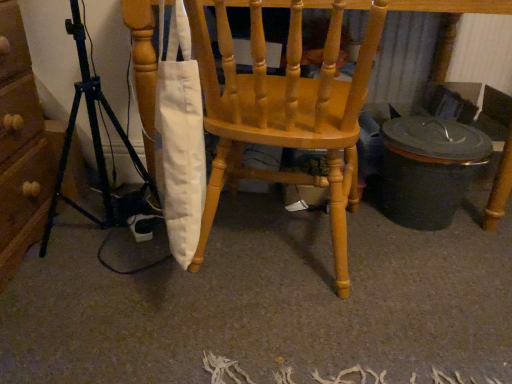
Question: From the image's perspective, is matte wood chair at center located above or below black metal tripod at left?

Choices:
 (A) above
 (B) below

Answer: (A)

Question: Would you say matte wood chair at center is to the left or to the right of black metal tripod at left in the picture?

Choices:
 (A) right
 (B) left

Answer: (A)

Question: From a real-world perspective, relative to black metal tripod at left, is matte wood chair at center vertically above or below?

Choices:
 (A) below
 (B) above

Answer: (B)

Question: Is black metal tripod at left in front of or behind matte wood chair at center in the image?

Choices:
 (A) front
 (B) behind

Answer: (A)

Question: From a real-world perspective, is black metal tripod at left physically located above or below matte wood chair at center?

Choices:
 (A) above
 (B) below

Answer: (B)

Question: Looking at the image, does black metal tripod at left seem bigger or smaller compared to matte wood chair at center?

Choices:
 (A) small
 (B) big

Answer: (A)

Question: Is black metal tripod at left spatially inside matte wood chair at center, or outside of it?

Choices:
 (A) inside
 (B) outside

Answer: (B)